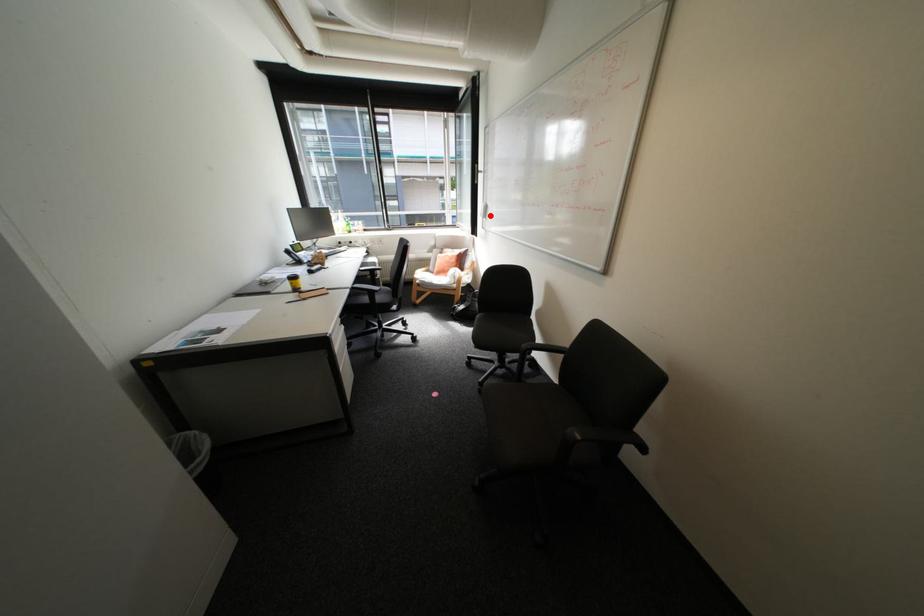
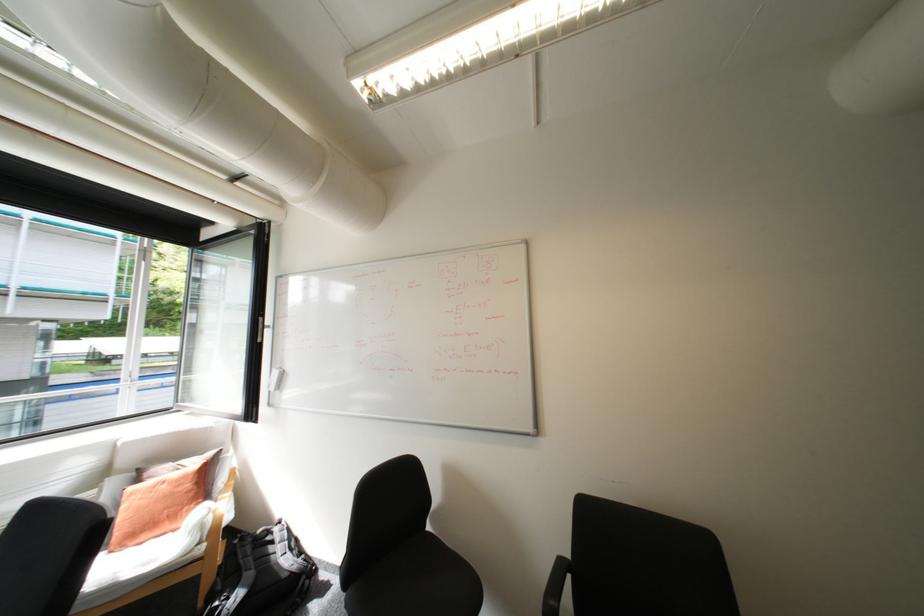
Question: A red point is marked in image1. In image2, is the corresponding 3D point closer to the camera or farther? Reply with the corresponding letter.

Choices:
 (A) The corresponding 3D point is closer.
 (B) The corresponding 3D point is farther.

Answer: (B)